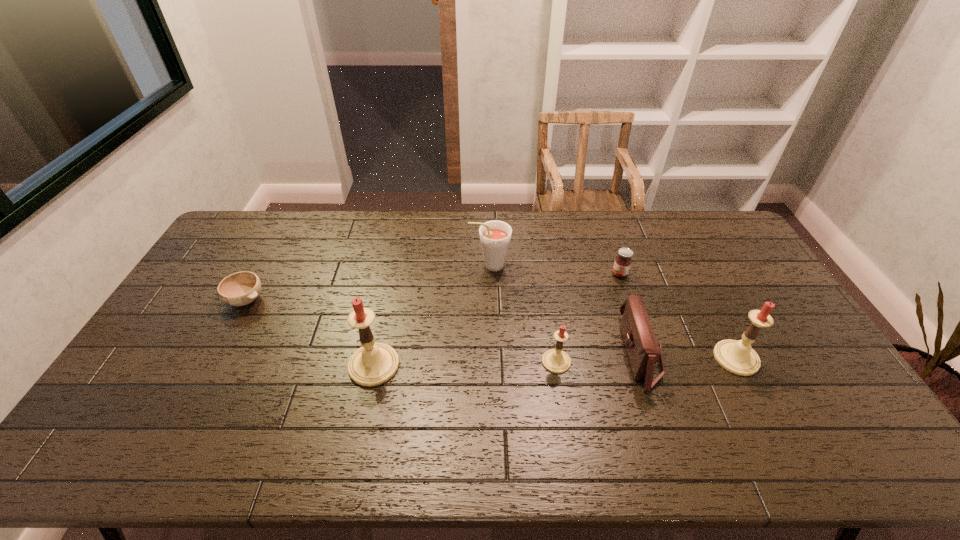
Where is `empty space that is in between the shoulder bag and the leftmost candle`? empty space that is in between the shoulder bag and the leftmost candle is located at coordinates (507, 359).

Image resolution: width=960 pixels, height=540 pixels. Find the location of `free spot between the jam and the fourth object from left to right`. free spot between the jam and the fourth object from left to right is located at coordinates (588, 318).

Locate an element on the screen. The height and width of the screenshot is (540, 960). free space between the rightmost candle and the sixth tallest object is located at coordinates (678, 316).

The image size is (960, 540). In order to click on free point between the rightmost candle and the shoulder bag in this screenshot , I will do `click(688, 356)`.

The height and width of the screenshot is (540, 960). I want to click on vacant area that lies between the fifth nearest object and the rightmost object, so click(x=492, y=329).

Where is `free space between the shortest candle and the shoulder bag`? This screenshot has width=960, height=540. free space between the shortest candle and the shoulder bag is located at coordinates (598, 357).

The image size is (960, 540). What are the coordinates of `free space between the fourth object from right to left and the shortest object` in the screenshot? It's located at (401, 331).

Locate an element on the screen. The height and width of the screenshot is (540, 960). vacant space in between the leftmost object and the sixth object from right to left is located at coordinates (310, 333).

The width and height of the screenshot is (960, 540). I want to click on object that is the third nearest to the shortest object, so click(557, 361).

Locate which object ranks third in proximity to the shoulder bag. Please provide its 2D coordinates. Your answer should be formatted as a tuple, i.e. [(x, y)], where the tuple contains the x and y coordinates of a point satisfying the conditions above.

[(622, 263)]